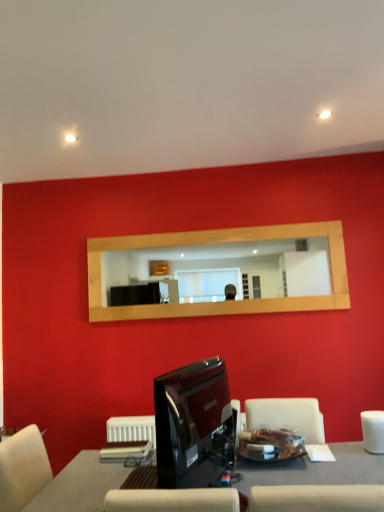
You are a GUI agent. You are given a task and a screenshot of the screen. Output one action in this format:
    pyautogui.click(x=<x>, y=<y>)
    Task: Click on the vacant area situated to the left side of white matte armchair at lower right
    The width and height of the screenshot is (384, 512).
    Given the screenshot: What is the action you would take?
    pyautogui.click(x=346, y=454)